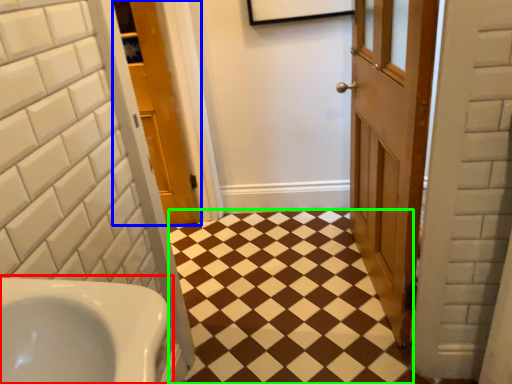
Question: Which object is the farthest from sink (highlighted by a red box)? Choose among these: door (highlighted by a blue box) or square (highlighted by a green box).

Choices:
 (A) door
 (B) square

Answer: (A)